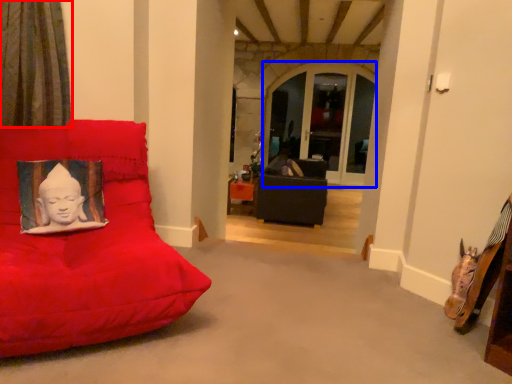
Question: Which of the following is the farthest to the observer, curtain (highlighted by a red box) or window (highlighted by a blue box)?

Choices:
 (A) curtain
 (B) window

Answer: (B)